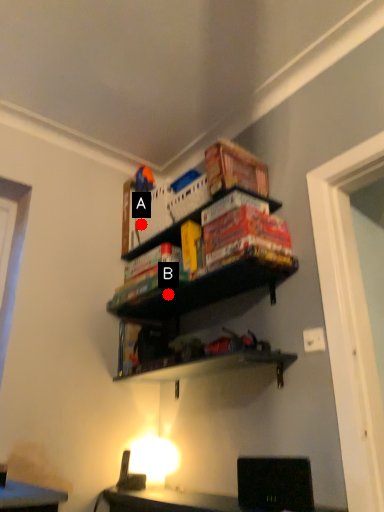
Question: Two points are circled on the image, labeled by A and B beside each circle. Which point is farther to the camera?

Choices:
 (A) A is further
 (B) B is further

Answer: (A)